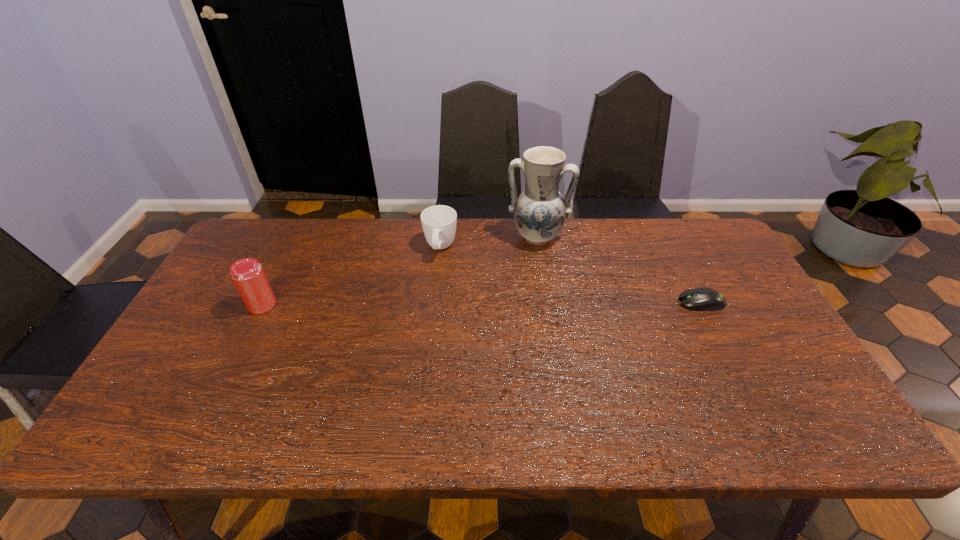
Image resolution: width=960 pixels, height=540 pixels. In order to click on unoccupied position between the rightmost object and the third object from right to left in this screenshot , I will do `click(570, 275)`.

This screenshot has width=960, height=540. Find the location of `free space between the shortest object and the second shortest object`. free space between the shortest object and the second shortest object is located at coordinates (570, 275).

The image size is (960, 540). I want to click on vacant area between the third object from right to left and the leftmost object, so click(351, 276).

Where is `unoccupied area between the rightmost object and the leftmost object`? This screenshot has width=960, height=540. unoccupied area between the rightmost object and the leftmost object is located at coordinates (482, 303).

Identify the location of free space that is in between the leftmost object and the rightmost object. click(x=482, y=303).

Identify the location of free area in between the shortest object and the leftmost object. (482, 303).

Where is `empty space between the shortest object and the second shortest object`? empty space between the shortest object and the second shortest object is located at coordinates (570, 275).

At what (x,y) coordinates should I click in order to perform the action: click on free space between the shortest object and the leftmost object. Please return your answer as a coordinate pair (x, y). The height and width of the screenshot is (540, 960). Looking at the image, I should click on [482, 303].

Where is `object that can be found as the second closest to the cup`? object that can be found as the second closest to the cup is located at coordinates (247, 274).

Point out which object is positioned as the second nearest to the pottery. Please provide its 2D coordinates. Your answer should be formatted as a tuple, i.e. [(x, y)], where the tuple contains the x and y coordinates of a point satisfying the conditions above.

[(701, 299)]